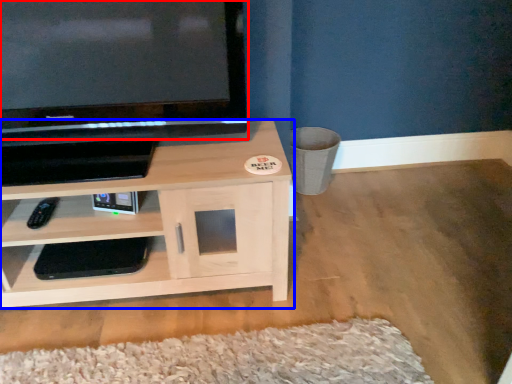
Question: Which of the following is the farthest to the observer, television (highlighted by a red box) or shelf (highlighted by a blue box)?

Choices:
 (A) television
 (B) shelf

Answer: (B)